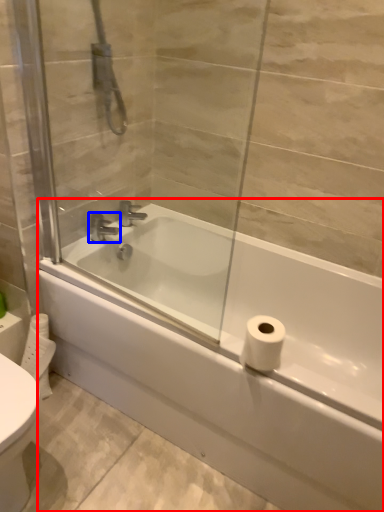
Question: Which of the following is the closest to the observer, bathtub (highlighted by a red box) or tap (highlighted by a blue box)?

Choices:
 (A) bathtub
 (B) tap

Answer: (A)